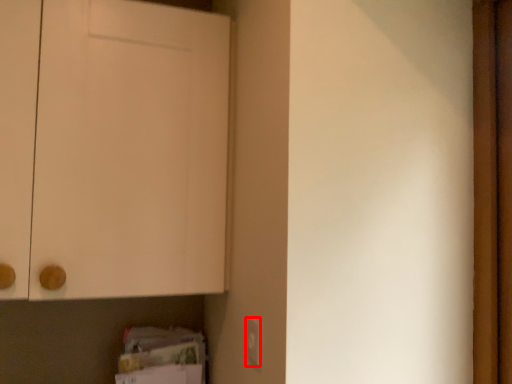
Question: Observing the image, what is the correct spatial positioning of electric outlet (annotated by the red box) in reference to door?

Choices:
 (A) right
 (B) left

Answer: (A)